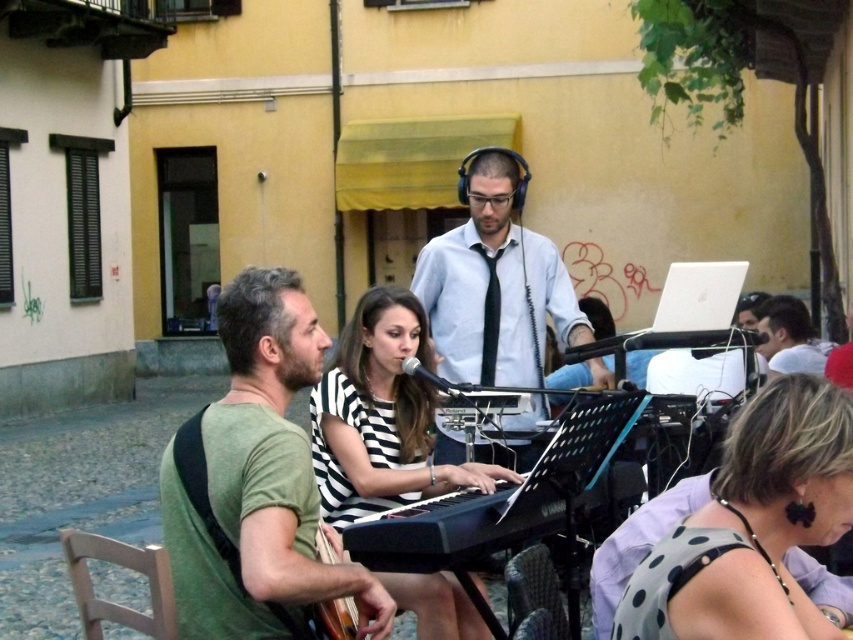
Question: Is polka dot fabric dress at lower right wider than wooden acoustic guitar at lower left?

Choices:
 (A) yes
 (B) no

Answer: (A)

Question: Which object is positioned farthest from the black plastic keyboard at center?

Choices:
 (A) polka dot fabric dress at lower right
 (B) green cotton shirt at center
 (C) wooden acoustic guitar at lower left

Answer: (A)

Question: Is wooden chair at lower left wider than white shirt at right?

Choices:
 (A) no
 (B) yes

Answer: (A)

Question: Which of the following is the closest to the observer?

Choices:
 (A) (346, 598)
 (B) (503, 202)
 (C) (408, 608)
 (D) (749, 547)

Answer: (D)

Question: Is polka dot fabric dress at lower right bigger than black and white striped dress at center?

Choices:
 (A) no
 (B) yes

Answer: (A)

Question: Which point is closer to the camera?

Choices:
 (A) (490, 296)
 (B) (775, 362)
 (C) (410, 440)

Answer: (C)